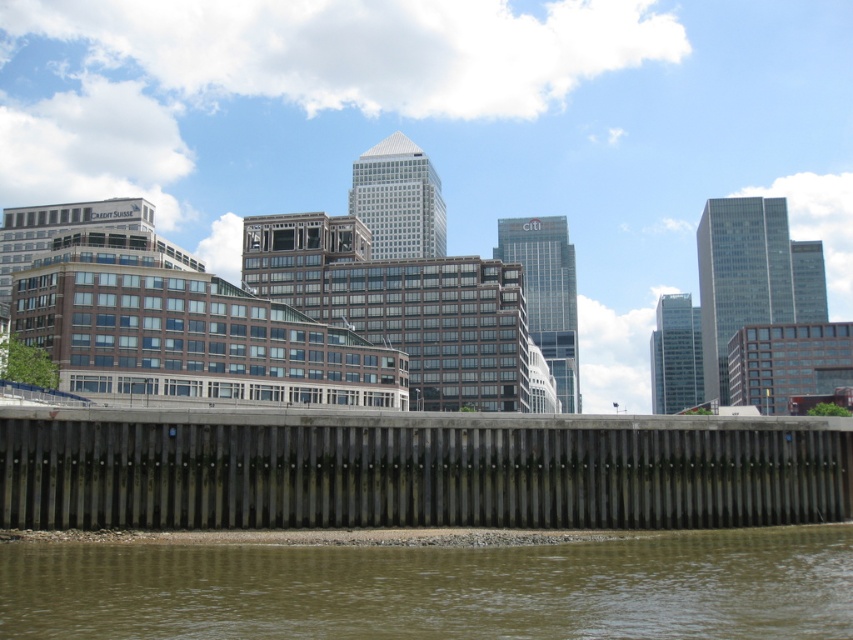
You are standing on the wooden retaining wall in the scene and want to place a small potted plant. The potted plant needs to be placed between the dark gray concrete dam at lower center and the brown gravel at lower center. Is this possible?

The dark gray concrete dam at lower center is located above the brown gravel at lower center, so there is space between them where you can place the potted plant.

You are a construction worker needing to transport materials from the dark gray concrete dam at lower center to the brown gravel at lower center. Given that your equipment can only handle a maximum distance of 25 feet between the two points, will you be able to safely move the materials?

The distance between the dark gray concrete dam at lower center and the brown gravel at lower center is 25.48 feet, which exceeds the equipment limit of 25 feet. Therefore, you cannot safely move the materials with the current equipment.

You are standing on the wooden retaining wall in the scene and notice two features below you. Which one is more to the left side between the dark gray concrete dam at lower center and the brown gravel at lower center?

The dark gray concrete dam at lower center is positioned on the left side of brown gravel at lower center, so it is more to the left side.